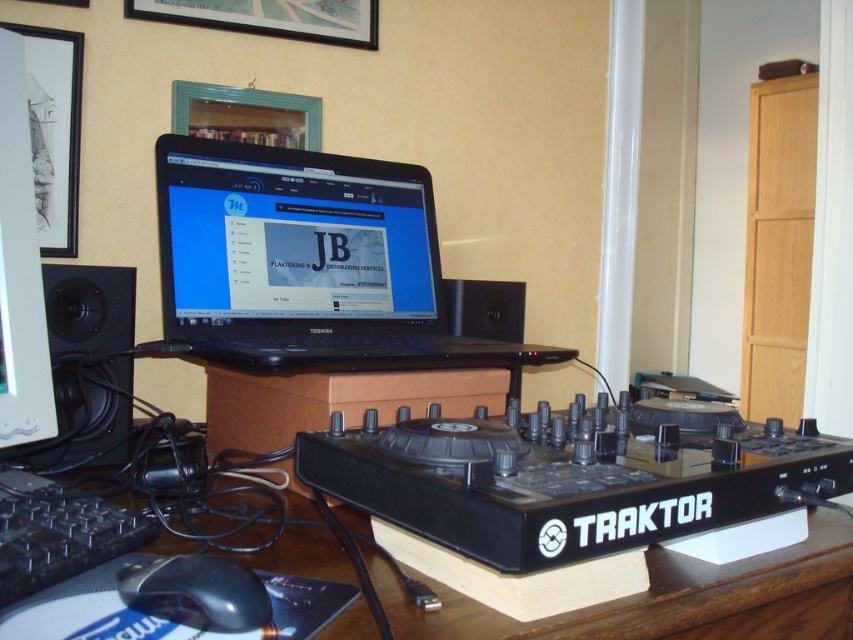
You are setting up a DJ booth and need to place the black matte speaker at left and the black plastic mouse at lower left on a shelf. Which object should you place first if you want to maximize the shelf space efficiency?

The black matte speaker at left is bigger than the black plastic mouse at lower left, so you should place the black matte speaker at left first to maximize shelf space efficiency by placing larger items first.

You are a DJ setting up your equipment and need to place a USB drive on the desk. You want to position it closer to the white glossy paper at left than to any other object. Which object should you place the USB drive nearest to?

The USB drive should be placed nearest to the white glossy paper at left since it is the closest object to the camera at 29.18 inches, allowing the USB to be positioned closer to it than any other object on the desk.

Based on the photo, you are setting up a DJ station and need to place a small USB drive on the desk. You have a white glossy paper at left and a black plastic mouse at lower left. Which object has a smaller width, making it easier to place the USB drive next to it?

The white glossy paper at left has a smaller width than the black plastic mouse at lower left, so placing the USB drive next to it would be easier.